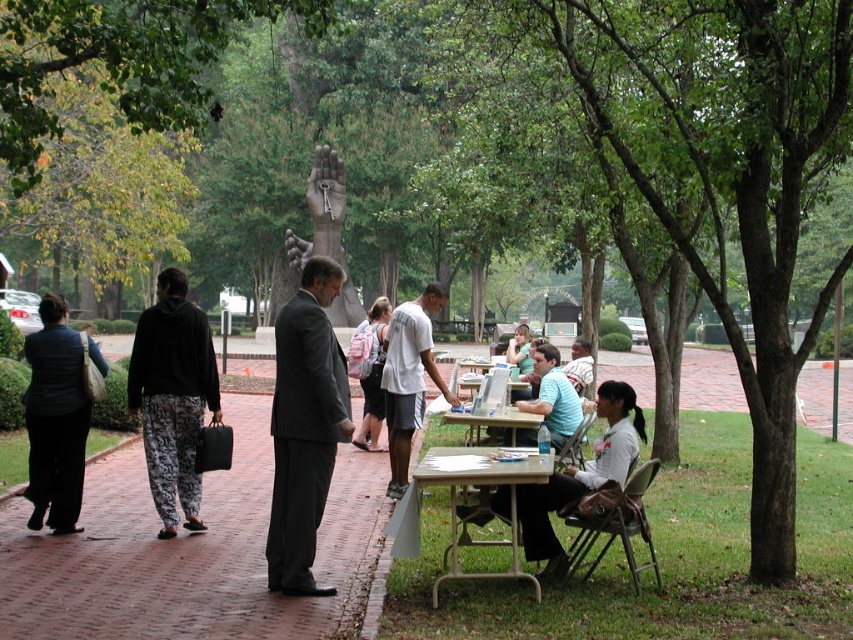
You are standing at the point marked by the coordinates point (370, 371) in the image. Looking around, you see the light pink backpack at center. What object is located exactly at your current position?

The point (370, 371) corresponds to the light pink backpack at center.

You are standing at the statue of the hand holding a key in the park. You see two points marked in the image. Which point is closer to you, point (x=518, y=476) or point (x=438, y=305)?

Point (x=518, y=476) is closer to you than point (x=438, y=305).

You are a delivery person who needs to place a package on the metallic silver table at lower center. According to the coordinates provided in the scene description, where exactly should you place the package?

The metallic silver table at lower center is located at coordinates point (480, 486), so you should place the package there.